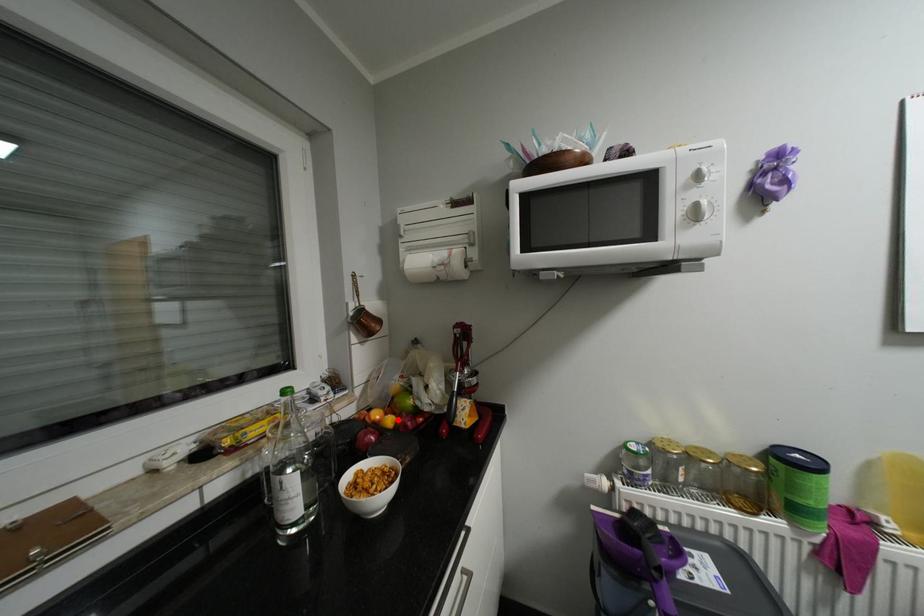
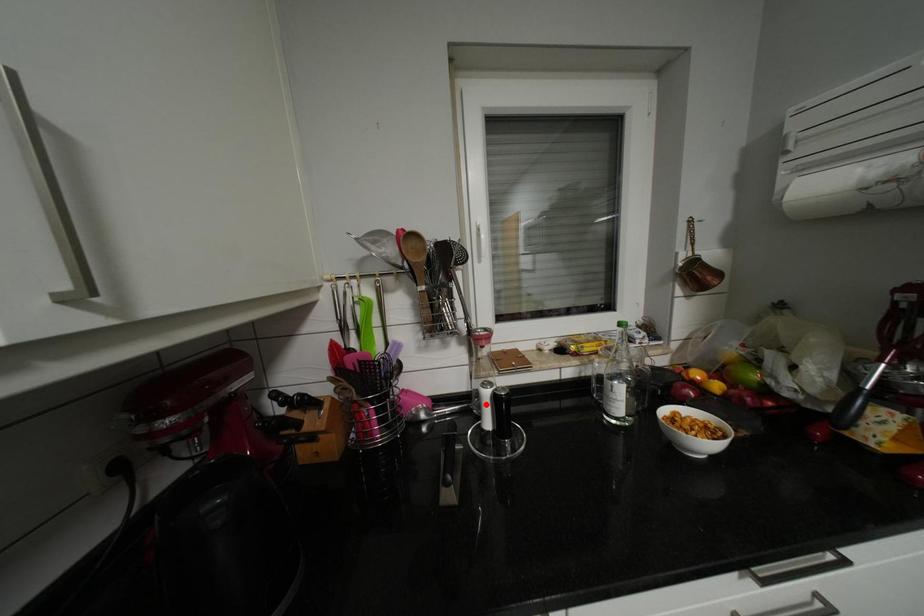
I am providing you with two images of the same scene from different viewpoints. A red point is marked on the first image and another point is marked on the second image. Do the highlighted points in image1 and image2 indicate the same real-world spot?

No